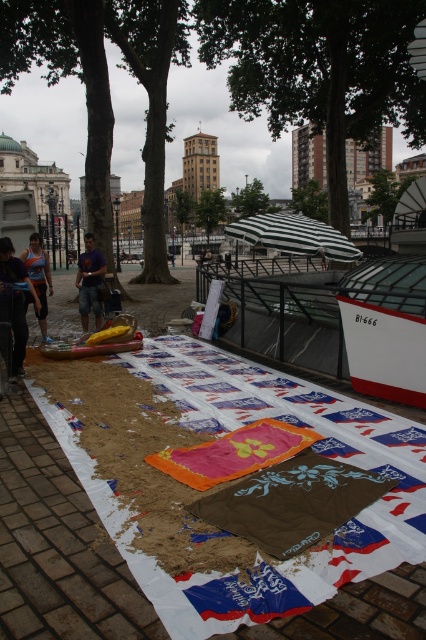
Question: Is brown paper at center smaller than orange athletic top at center?

Choices:
 (A) yes
 (B) no

Answer: (B)

Question: Among these points, which one is farthest from the camera?

Choices:
 (A) (40, 298)
 (B) (19, 342)
 (C) (91, 252)
 (D) (65, 349)

Answer: (C)

Question: Is the position of brown paper at center more distant than that of purple cotton t-shirt at center?

Choices:
 (A) no
 (B) yes

Answer: (A)

Question: Which of the following is the closest to the observer?

Choices:
 (A) (29, 275)
 (B) (69, 356)
 (C) (5, 529)
 (D) (97, 305)

Answer: (C)

Question: Which point is farther to the camera?

Choices:
 (A) (31, 298)
 (B) (52, 355)
 (C) (100, 323)
 (D) (149, 616)

Answer: (C)

Question: Can you confirm if orange athletic top at center is positioned above yellow plastic kayak at center?

Choices:
 (A) no
 (B) yes

Answer: (B)